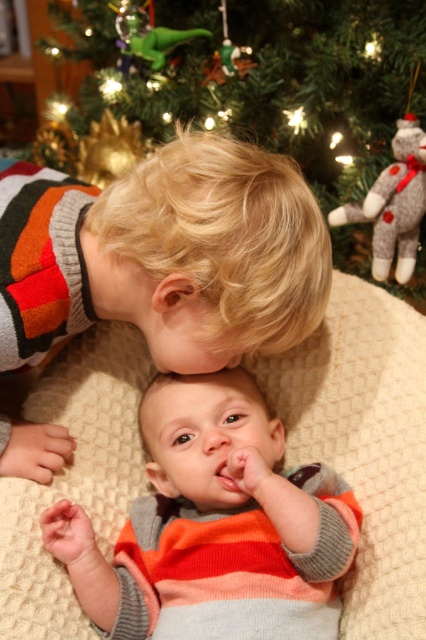
Does point (230, 586) come in front of point (393, 92)?

Yes, it is in front of point (393, 92).

Between striped sweater baby at center and green matte ornament at upper center, which one has less height?

striped sweater baby at center

Who is more distant from viewer, (x=331, y=532) or (x=377, y=168)?

Positioned behind is point (x=377, y=168).

Locate an element on the screen. The height and width of the screenshot is (640, 426). striped sweater baby at center is located at coordinates (215, 525).

Looking at this image, can you confirm if striped sweater at center is positioned to the right of striped sweater baby at center?

Incorrect, striped sweater at center is not on the right side of striped sweater baby at center.

Locate an element on the screen. This screenshot has width=426, height=640. striped sweater at center is located at coordinates (169, 256).

Describe the element at coordinates (169, 256) in the screenshot. The height and width of the screenshot is (640, 426). I see `striped sweater at center` at that location.

Which of these two, striped sweater at center or green matte ornament at upper center, stands shorter?

Standing shorter between the two is striped sweater at center.

What do you see at coordinates (169, 256) in the screenshot?
I see `striped sweater at center` at bounding box center [169, 256].

Identify the location of striped sweater at center. The image size is (426, 640). (169, 256).